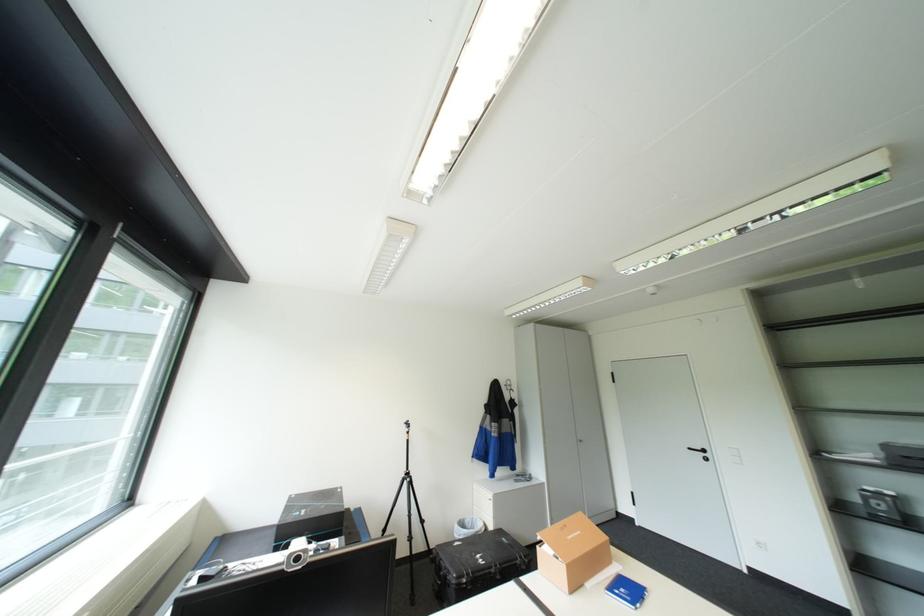
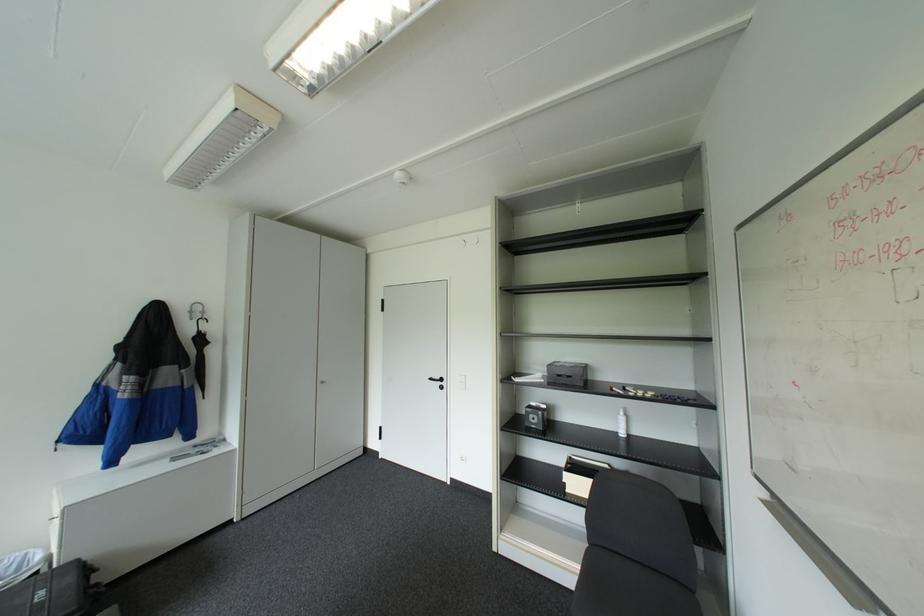
Find the pixel in the second image that matches (888,504) in the first image.

(541, 416)